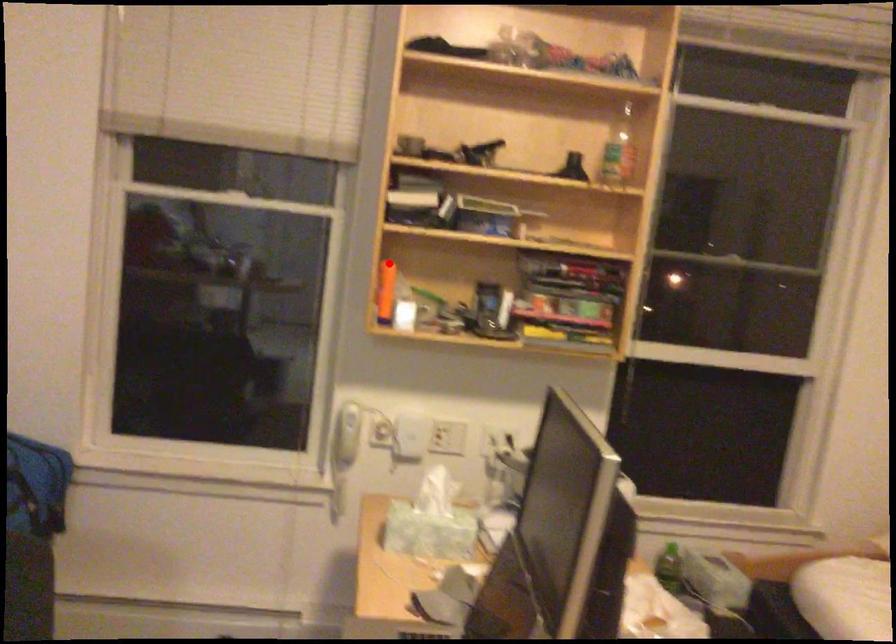
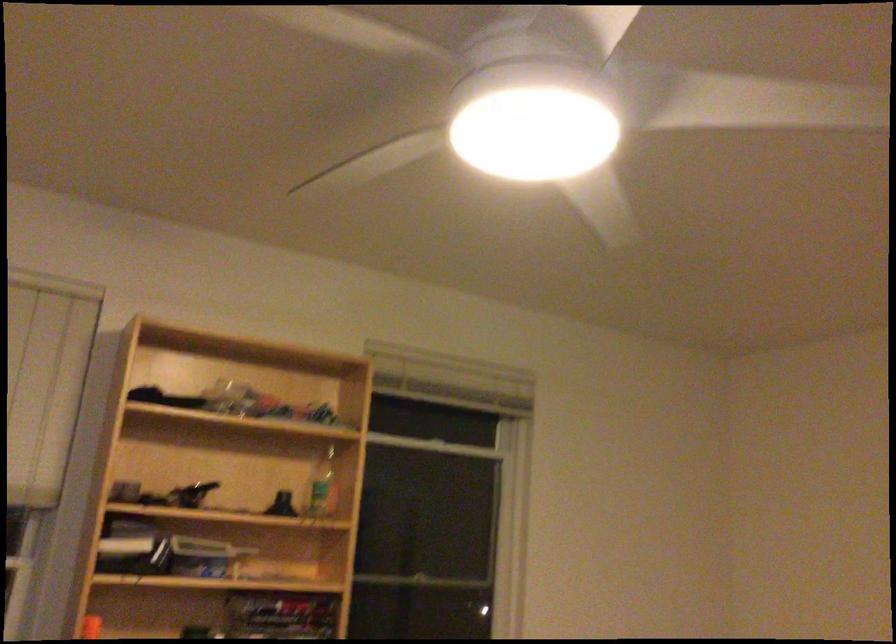
Question: I am providing you with two images of the same scene from different viewpoints. In image1, a red point is highlighted. Considering the same 3D point in image2, which of the following is correct?

Choices:
 (A) It is closer
 (B) It is farther

Answer: (A)